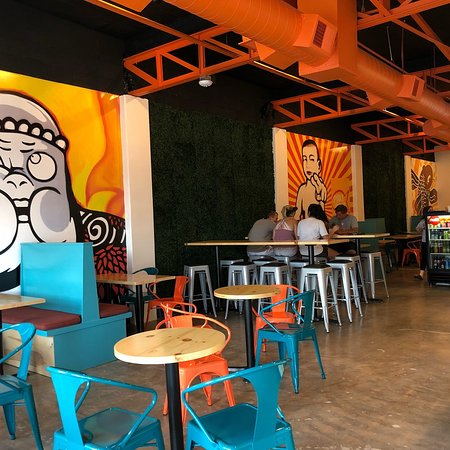
Identify the location of circle table. This screenshot has height=450, width=450. (265, 293), (168, 356).